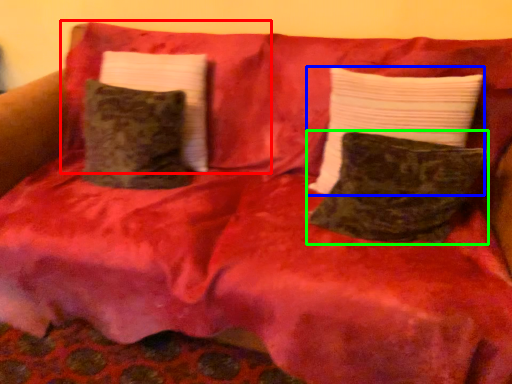
Question: Which object is the farthest from pillow (highlighted by a red box)? Choose among these: pillow (highlighted by a blue box) or pillow (highlighted by a green box).

Choices:
 (A) pillow
 (B) pillow

Answer: (B)